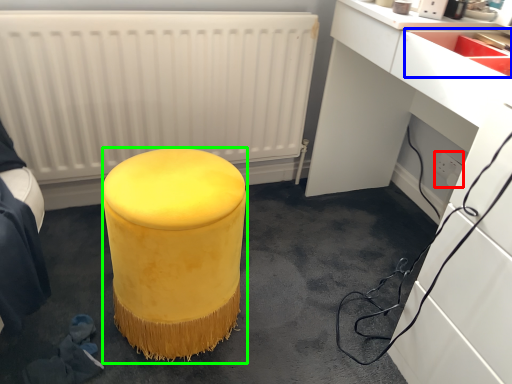
Question: Based on their relative distances, which object is nearer to electric outlet (highlighted by a red box)? Choose from sink (highlighted by a blue box) and furniture (highlighted by a green box).

Choices:
 (A) sink
 (B) furniture

Answer: (A)